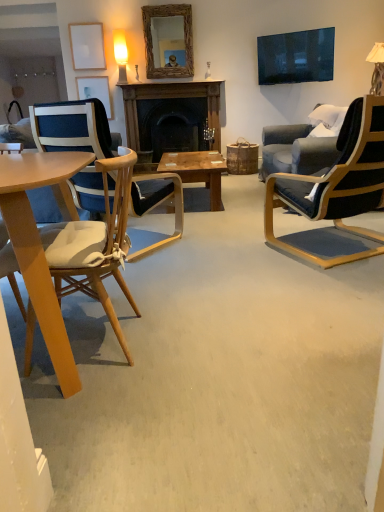
The height and width of the screenshot is (512, 384). In order to click on free space to the left of black leather chair at right, marked as the first chair in a right-to-left arrangement in this screenshot , I will do `click(223, 251)`.